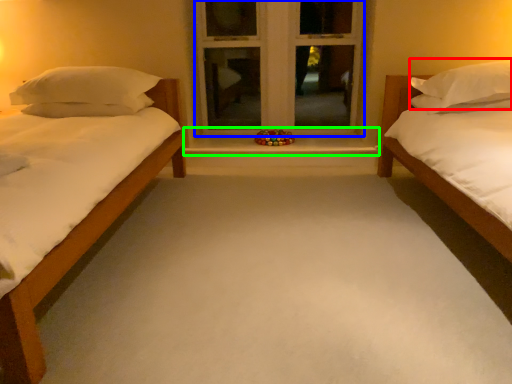
Question: Considering the real-world distances, which object is farthest from pillow (highlighted by a red box)? window frame (highlighted by a blue box) or window sill (highlighted by a green box)?

Choices:
 (A) window frame
 (B) window sill

Answer: (A)